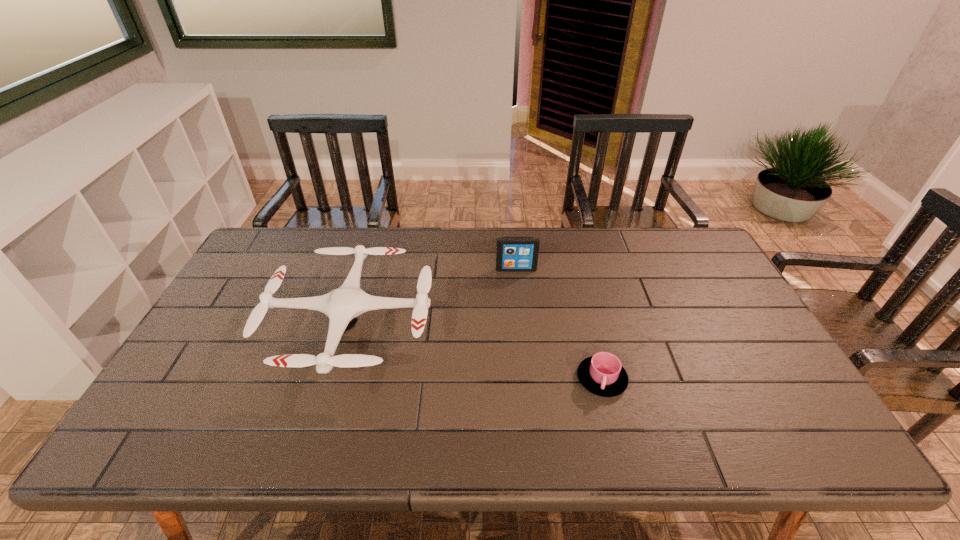
In order to click on blank space at the near edge of the desktop in this screenshot , I will do `click(669, 453)`.

Locate an element on the screen. This screenshot has width=960, height=540. vacant space at the left edge is located at coordinates (218, 347).

Locate an element on the screen. Image resolution: width=960 pixels, height=540 pixels. vacant area at the right edge of the desktop is located at coordinates (714, 342).

This screenshot has height=540, width=960. Identify the location of free space at the far left corner of the desktop. (295, 246).

Image resolution: width=960 pixels, height=540 pixels. In the image, there is a desktop. Find the location of `vacant space at the near left corner`. vacant space at the near left corner is located at coordinates (211, 429).

The width and height of the screenshot is (960, 540). In the image, there is a desktop. Find the location of `free region at the far right corner`. free region at the far right corner is located at coordinates (684, 254).

You are a GUI agent. You are given a task and a screenshot of the screen. Output one action in this format:
    pyautogui.click(x=<x>, y=<y>)
    Task: Click on the free area in between the drone and the second object from right to left
    The width and height of the screenshot is (960, 540).
    Given the screenshot: What is the action you would take?
    pyautogui.click(x=434, y=297)

You are a GUI agent. You are given a task and a screenshot of the screen. Output one action in this format:
    pyautogui.click(x=<x>, y=<y>)
    Task: Click on the vacant point located between the drone and the cup
    
    Given the screenshot: What is the action you would take?
    pyautogui.click(x=476, y=352)

Locate an element on the screen. This screenshot has height=540, width=960. free space between the cup and the drone is located at coordinates click(x=476, y=352).

Image resolution: width=960 pixels, height=540 pixels. I want to click on unoccupied position between the farthest object and the shortest object, so click(559, 324).